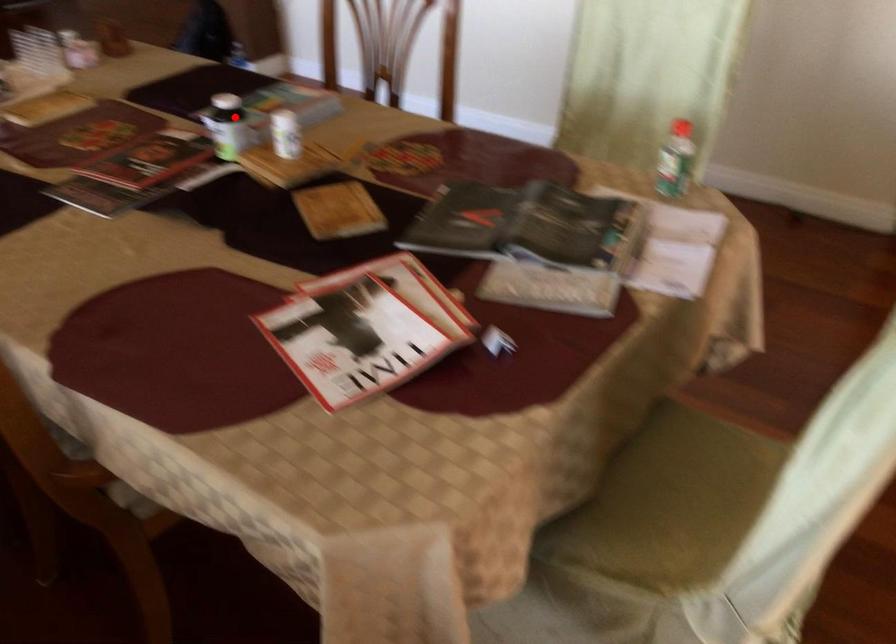
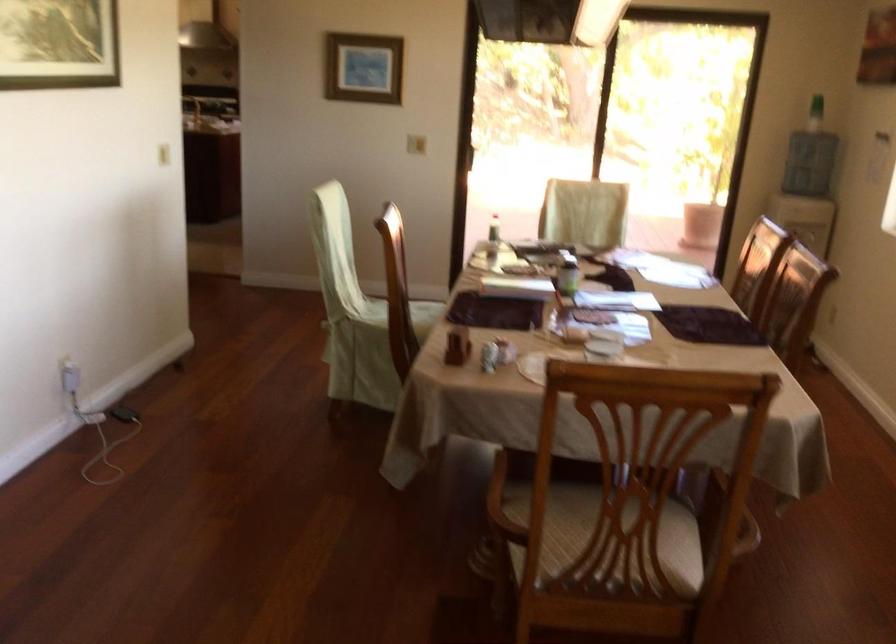
Find the pixel in the second image that matches the highlighted location in the first image.

(566, 272)